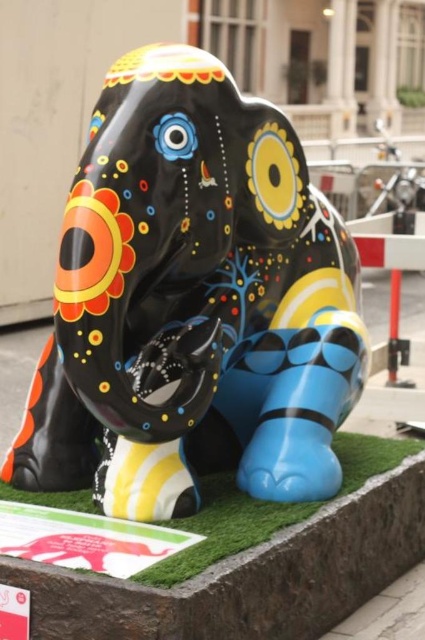
Question: Which point is closer to the camera taking this photo?

Choices:
 (A) (251, 513)
 (B) (180, 90)

Answer: (B)

Question: Which object is farther from the camera taking this photo?

Choices:
 (A) green artificial turf at lower center
 (B) glossy painted elephant at center

Answer: (B)

Question: Can you confirm if glossy painted elephant at center is positioned to the right of green artificial turf at lower center?

Choices:
 (A) yes
 (B) no

Answer: (B)

Question: From the image, what is the correct spatial relationship of glossy painted elephant at center in relation to green artificial turf at lower center?

Choices:
 (A) below
 (B) above

Answer: (B)

Question: Where is glossy painted elephant at center located in relation to green artificial turf at lower center in the image?

Choices:
 (A) below
 (B) above

Answer: (B)

Question: Among these objects, which one is farthest from the camera?

Choices:
 (A) glossy painted elephant at center
 (B) green artificial turf at lower center

Answer: (A)